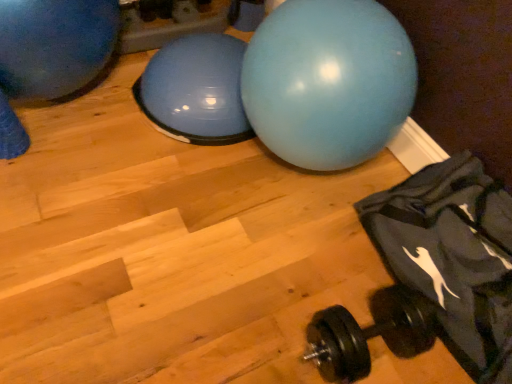
Question: Is the position of black rubber dumbbell at lower right less distant than that of dark gray fabric bean bag chair at lower right?

Choices:
 (A) yes
 (B) no

Answer: (B)

Question: Is black rubber dumbbell at lower right oriented away from dark gray fabric bean bag chair at lower right?

Choices:
 (A) no
 (B) yes

Answer: (B)

Question: From the image's perspective, does black rubber dumbbell at lower right appear lower than dark gray fabric bean bag chair at lower right?

Choices:
 (A) yes
 (B) no

Answer: (A)

Question: Does black rubber dumbbell at lower right have a greater width compared to dark gray fabric bean bag chair at lower right?

Choices:
 (A) no
 (B) yes

Answer: (A)

Question: Considering the relative sizes of black rubber dumbbell at lower right and dark gray fabric bean bag chair at lower right in the image provided, is black rubber dumbbell at lower right bigger than dark gray fabric bean bag chair at lower right?

Choices:
 (A) yes
 (B) no

Answer: (B)

Question: From the image's perspective, is black rubber dumbbell at lower right on dark gray fabric bean bag chair at lower right?

Choices:
 (A) yes
 (B) no

Answer: (B)

Question: From a real-world perspective, does black rubber dumbbell at lower right sit lower than matte blue ball at center, which is counted as the 1th ball, starting from the right?

Choices:
 (A) no
 (B) yes

Answer: (B)

Question: Could matte blue ball at center, which is counted as the 1th ball, starting from the right, be considered to be inside black rubber dumbbell at lower right?

Choices:
 (A) yes
 (B) no

Answer: (B)

Question: Is black rubber dumbbell at lower right oriented towards matte blue ball at center, which is counted as the 1th ball, starting from the right?

Choices:
 (A) yes
 (B) no

Answer: (B)

Question: Considering the relative positions of black rubber dumbbell at lower right and matte blue ball at center, which is counted as the 1th ball, starting from the right, in the image provided, is black rubber dumbbell at lower right to the right of matte blue ball at center, which is counted as the 1th ball, starting from the right, from the viewer's perspective?

Choices:
 (A) no
 (B) yes

Answer: (B)

Question: Is black rubber dumbbell at lower right turned away from matte blue ball at center, which is counted as the 1th ball, starting from the right?

Choices:
 (A) no
 (B) yes

Answer: (A)

Question: Considering the relative sizes of black rubber dumbbell at lower right and matte blue ball at center, which is counted as the 1th ball, starting from the right, in the image provided, is black rubber dumbbell at lower right taller than matte blue ball at center, which is counted as the 1th ball, starting from the right,?

Choices:
 (A) yes
 (B) no

Answer: (B)

Question: Is matte blue ball at center, which is counted as the 1th ball, starting from the right, surrounding black rubber dumbbell at lower right?

Choices:
 (A) yes
 (B) no

Answer: (B)